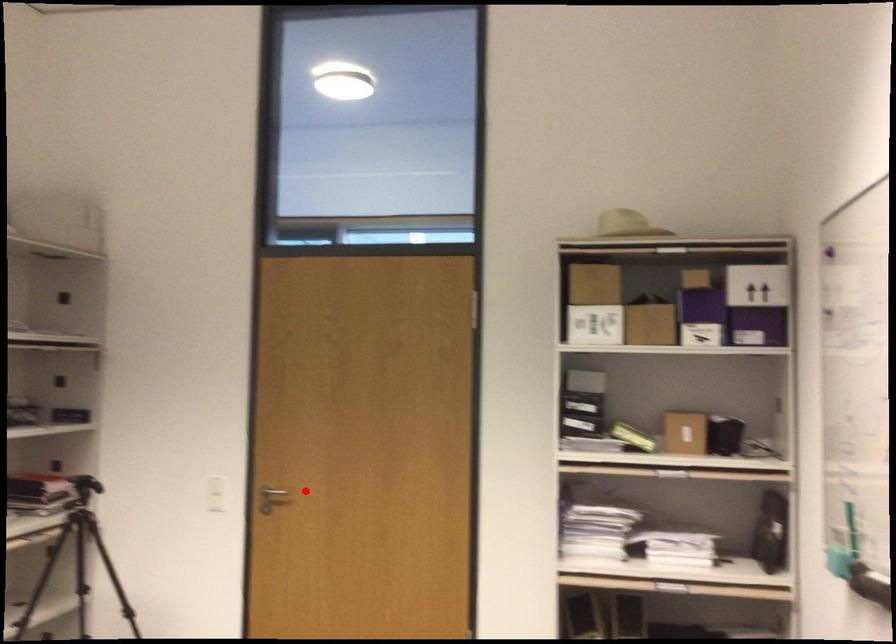
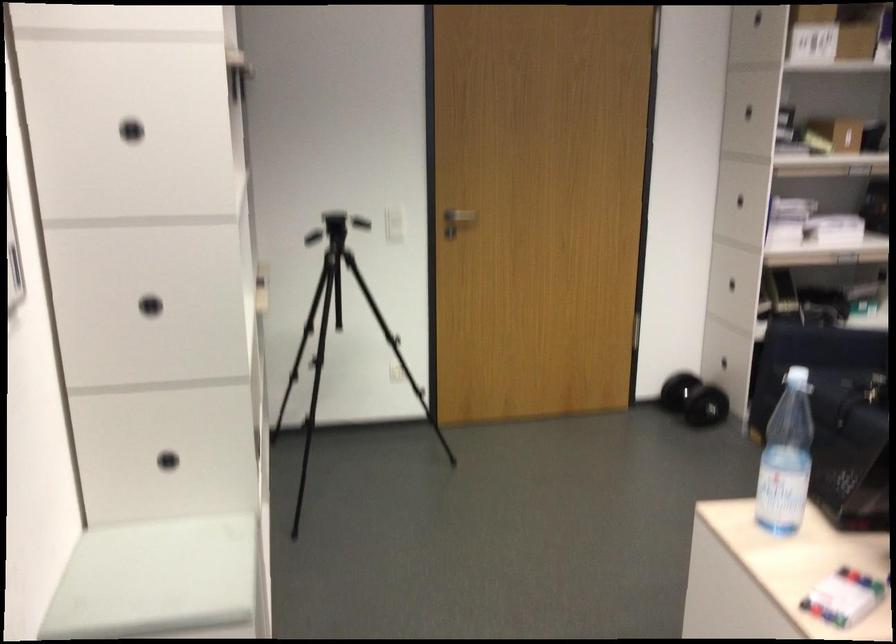
Locate, in the second image, the point that corresponds to the highlighted location in the first image.

(460, 216)